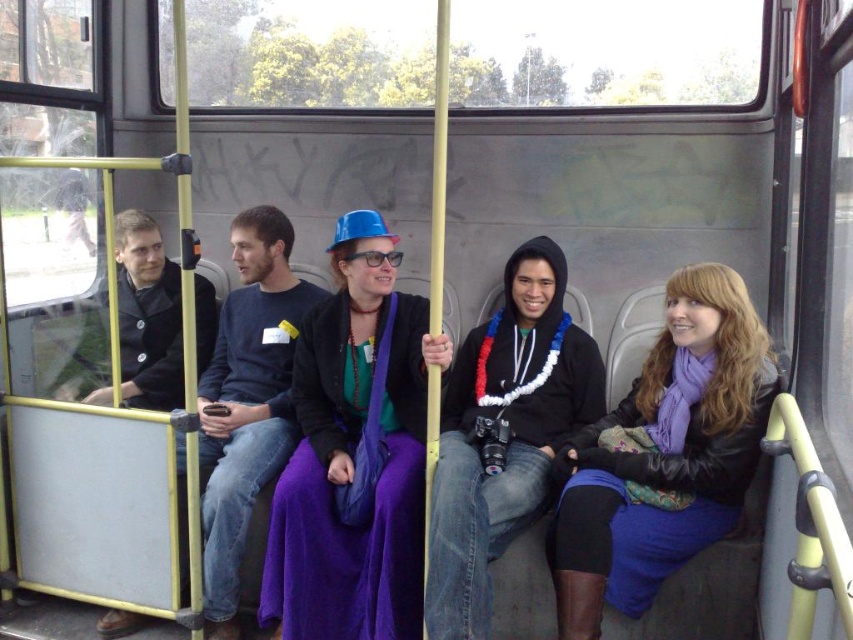
You are a photographer trying to capture a clear shot of both the purple matte dress at center and the matte black hoodie at center from the front of the bus. Which one will appear closer to the camera in your photo?

The purple matte dress at center will appear closer to the camera because it is positioned further to the viewer than the matte black hoodie at center.

You are a photographer trying to capture a closeup of both the purple matte scarf at center and the purple fabric coach at center through the bus window. Since the scarf is smaller, will you need to adjust your camera settings to focus on it better?

The purple matte scarf at center is smaller than the purple fabric coach at center. To capture a clear closeup of the smaller scarf, you may need to adjust your camera settings for better focus, such as using a higher zoom or aperture setting.